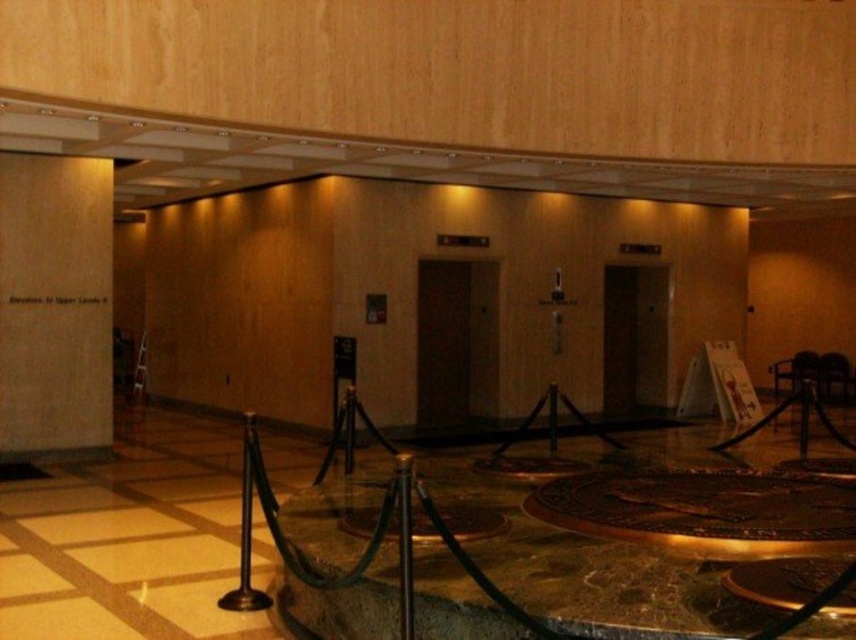
Question: Is wooden sign at left in front of metallic pole at center?

Choices:
 (A) no
 (B) yes

Answer: (A)

Question: Does brown metallic pole at center have a smaller size compared to metallic pole at center?

Choices:
 (A) yes
 (B) no

Answer: (B)

Question: Which object is farther from the camera taking this photo?

Choices:
 (A) brown metallic pole at center
 (B) metallic pole at center

Answer: (A)

Question: Does wooden sign at left come in front of brown metallic pole at center?

Choices:
 (A) no
 (B) yes

Answer: (A)

Question: Which point is closer to the camera?

Choices:
 (A) (107, 310)
 (B) (260, 602)

Answer: (B)

Question: Which of the following is the farthest from the observer?

Choices:
 (A) wooden sign at left
 (B) brown metallic pole at center

Answer: (A)